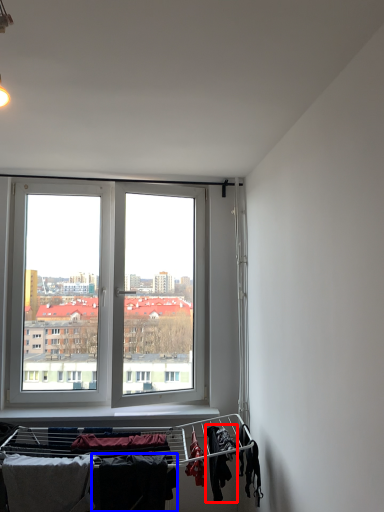
Question: Which point is closer to the camera, clothing (highlighted by a red box) or clothing (highlighted by a blue box)?

Choices:
 (A) clothing
 (B) clothing

Answer: (B)